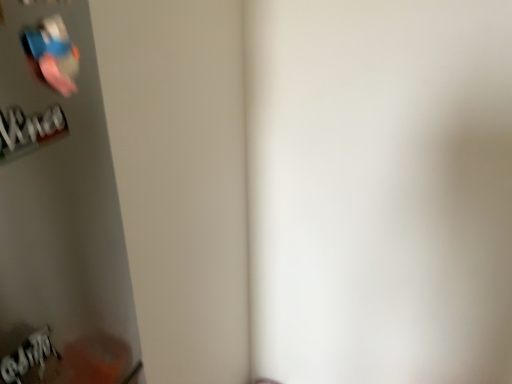
Question: From the image's perspective, is metallic blue wii remote at upper left above or below white paper at lower left, the second writing in the top-to-bottom sequence?

Choices:
 (A) above
 (B) below

Answer: (A)

Question: Is metallic blue wii remote at upper left taller or shorter than white paper at lower left, the 1th writing in the bottom-to-top sequence?

Choices:
 (A) tall
 (B) short

Answer: (B)

Question: Which object is positioned farthest from the metallic blue wii remote at upper left?

Choices:
 (A) white paper at lower left, the 1th writing in the bottom-to-top sequence
 (B) white paper at left, marked as the first writing in a top-to-bottom arrangement

Answer: (A)

Question: Which object is positioned farthest from the metallic blue wii remote at upper left?

Choices:
 (A) white paper at lower left, the second writing in the top-to-bottom sequence
 (B) white paper at left, marked as the first writing in a top-to-bottom arrangement

Answer: (A)